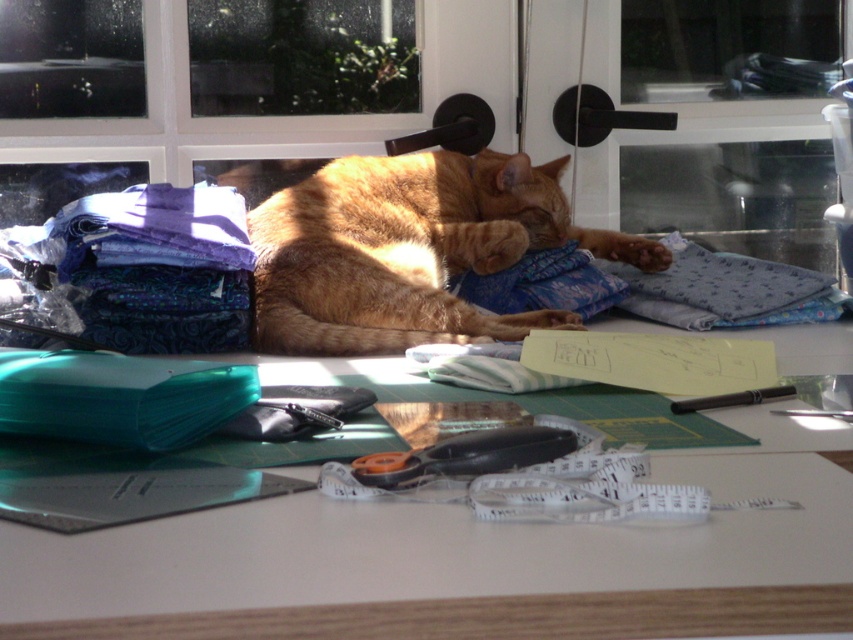
Question: Where is orange fur cat at center located in relation to blue fabric at center in the image?

Choices:
 (A) below
 (B) above

Answer: (B)

Question: Which object is farther from the camera taking this photo?

Choices:
 (A) purple fabric at left
 (B) blue fabric at center
 (C) orange fur cat at center

Answer: (B)

Question: Which point appears closest to the camera in this image?

Choices:
 (A) (154, 211)
 (B) (234, 513)
 (C) (677, 294)

Answer: (B)

Question: Can you confirm if orange fur cat at center is positioned to the right of blue fabric at center?

Choices:
 (A) yes
 (B) no

Answer: (B)

Question: Can you confirm if white glossy table at center is smaller than transparent glass window at upper center?

Choices:
 (A) no
 (B) yes

Answer: (A)

Question: Which is nearer to the orange fur cat at center?

Choices:
 (A) purple fabric at left
 (B) transparent glass window at upper center

Answer: (A)